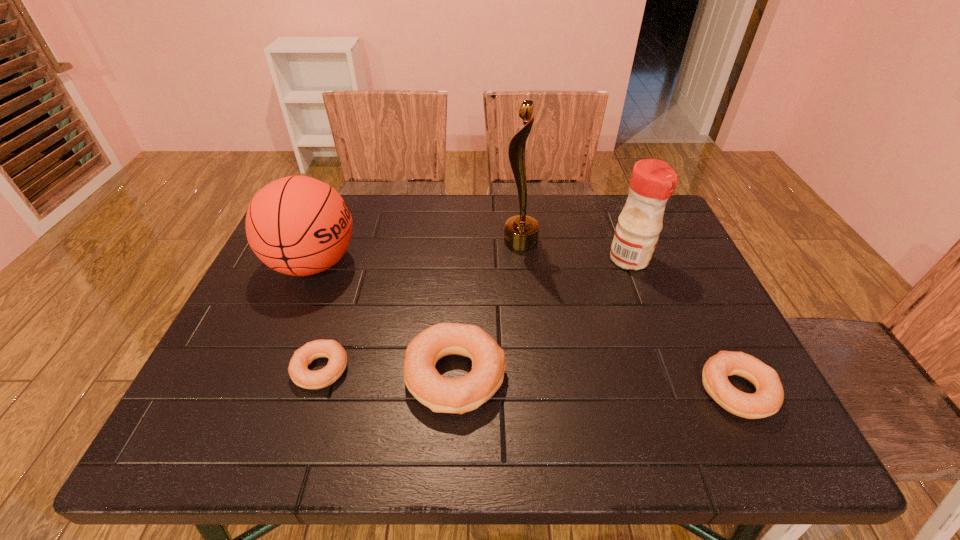
Where is `blank space located 0.140m on the right of the leftmost bagel`? The width and height of the screenshot is (960, 540). blank space located 0.140m on the right of the leftmost bagel is located at coordinates (415, 369).

Where is `vacant area located on the right of the fourth object from right to left`? The height and width of the screenshot is (540, 960). vacant area located on the right of the fourth object from right to left is located at coordinates (559, 376).

Locate an element on the screen. The height and width of the screenshot is (540, 960). vacant position located 0.230m on the back of the second tallest bagel is located at coordinates (686, 286).

Where is `free space located on the front-facing side of the award`? free space located on the front-facing side of the award is located at coordinates click(x=430, y=241).

Where is `free space located 0.290m on the front-facing side of the award`? This screenshot has height=540, width=960. free space located 0.290m on the front-facing side of the award is located at coordinates (401, 241).

What are the coordinates of `vacant space located 0.110m on the front-facing side of the award` in the screenshot? It's located at (466, 241).

Identify the location of vacant point located 0.200m on the side with logo of the basketball. Image resolution: width=960 pixels, height=540 pixels. (434, 264).

I want to click on free spot located on the left of the condiment, so click(x=502, y=259).

Where is `award positioned at the far edge`? The height and width of the screenshot is (540, 960). award positioned at the far edge is located at coordinates (521, 232).

Image resolution: width=960 pixels, height=540 pixels. I want to click on basketball located at the far edge, so click(297, 225).